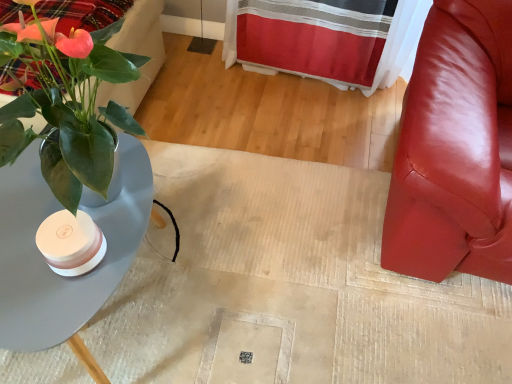
Find the location of a particular element. The width and height of the screenshot is (512, 384). vacant space to the left of glossy leather chair at right is located at coordinates (273, 183).